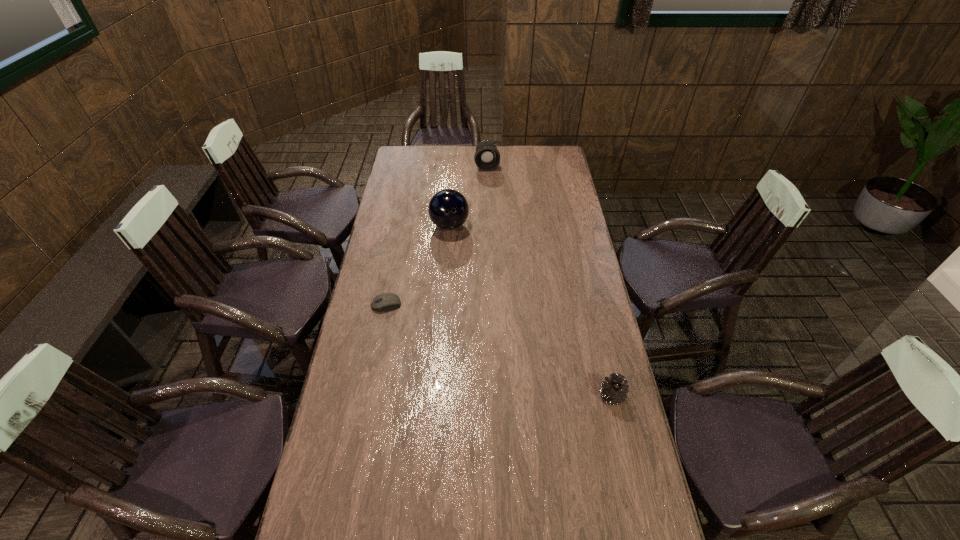
In the image, there is a desktop. Where is `free space at the near edge`? This screenshot has height=540, width=960. free space at the near edge is located at coordinates (547, 497).

Locate an element on the screen. Image resolution: width=960 pixels, height=540 pixels. vacant region at the left edge of the desktop is located at coordinates (397, 223).

The width and height of the screenshot is (960, 540). What are the coordinates of `blank space at the right edge of the desktop` in the screenshot? It's located at (609, 437).

I want to click on free spot at the far right corner of the desktop, so click(546, 145).

Where is `vacant area that lies between the third object from left to right and the rightmost object`? vacant area that lies between the third object from left to right and the rightmost object is located at coordinates (549, 281).

Where is `vacant point located between the third object from left to right and the third farthest object`? This screenshot has width=960, height=540. vacant point located between the third object from left to right and the third farthest object is located at coordinates (437, 235).

I want to click on blank region between the third object from right to left and the second tallest object, so click(468, 195).

Locate an element on the screen. Image resolution: width=960 pixels, height=540 pixels. free spot between the rightmost object and the second tallest object is located at coordinates (549, 281).

The width and height of the screenshot is (960, 540). I want to click on free spot between the farthest object and the nearest object, so [x=549, y=281].

Find the location of a particular element. The image size is (960, 540). blank region between the bowling ball and the computer equipment is located at coordinates (418, 265).